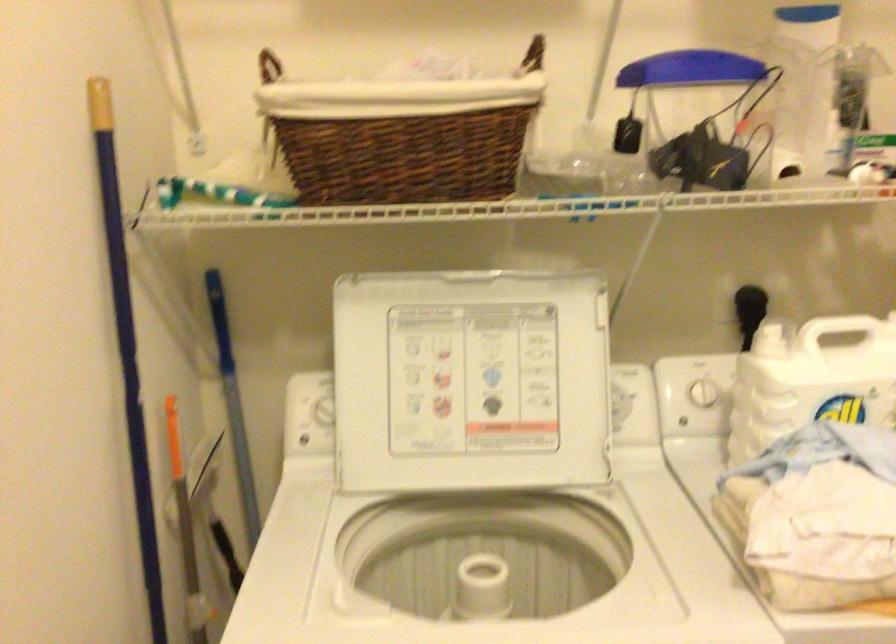
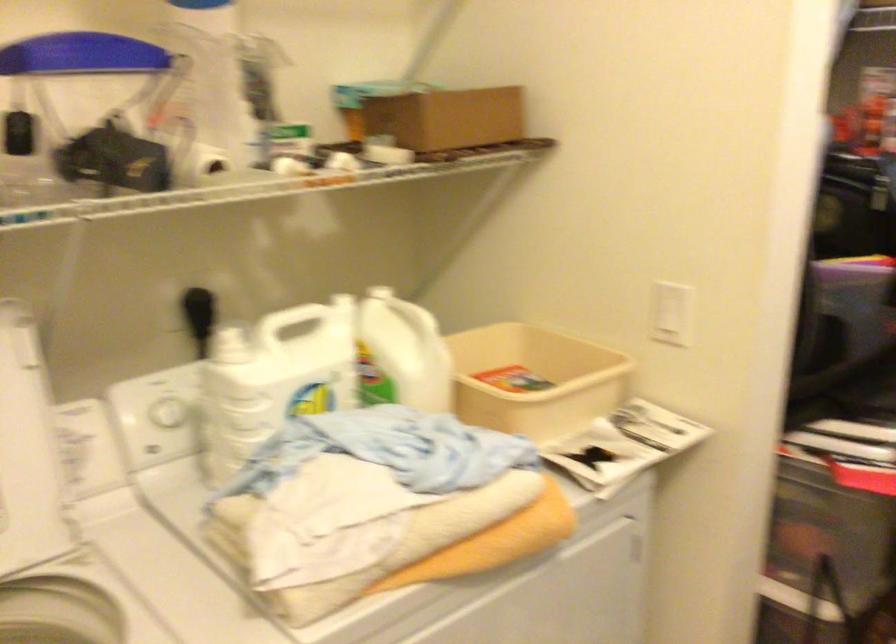
The point at (788, 171) is marked in the first image. Where is the corresponding point in the second image?

(211, 162)